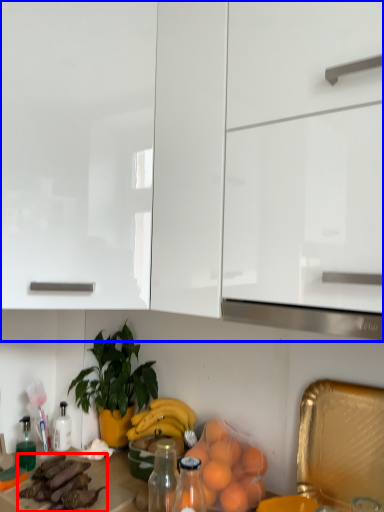
Question: Which point is closer to the camera, food (highlighted by a red box) or cabinetry (highlighted by a blue box)?

Choices:
 (A) food
 (B) cabinetry

Answer: (B)